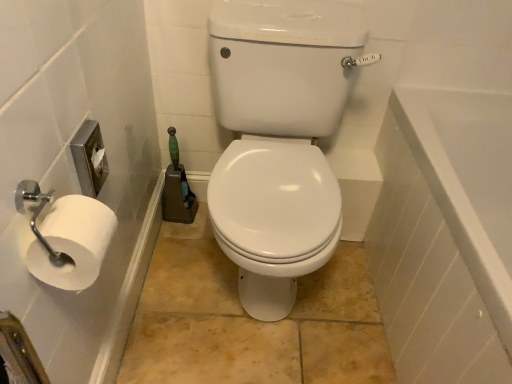
Looking at this image, what is the approximate height of white glossy bathtub at right?

The height of white glossy bathtub at right is 58.61 centimeters.

Measure the distance between point (470, 113) and camera.

Point (470, 113) and camera are 1.38 meters apart from each other.

The image size is (512, 384). Describe the element at coordinates (71, 242) in the screenshot. I see `white matte toilet paper at left` at that location.

You are a GUI agent. You are given a task and a screenshot of the screen. Output one action in this format:
    pyautogui.click(x=<x>, y=<y>)
    Task: Click on the white glossy toilet seat at center
    The image size is (512, 384).
    Given the screenshot: What is the action you would take?
    pyautogui.click(x=279, y=139)

Can you confirm if white matte toilet paper at left is taller than white glossy toilet seat at center?

In fact, white matte toilet paper at left may be shorter than white glossy toilet seat at center.

From the image's perspective, would you say white matte toilet paper at left is positioned over white glossy toilet seat at center?

No, from the image's perspective, white matte toilet paper at left is not over white glossy toilet seat at center.

From a real-world perspective, is white matte toilet paper at left physically above white glossy toilet seat at center?

Yes, from a real-world perspective, white matte toilet paper at left is on top of white glossy toilet seat at center.

Would you say white glossy bathtub at right is part of white glossy toilet seat at center's contents?

That's incorrect, white glossy bathtub at right is not inside white glossy toilet seat at center.

Which is behind, white glossy toilet seat at center or white glossy bathtub at right?

white glossy toilet seat at center is more distant.

Is white glossy toilet seat at center next to white glossy bathtub at right and touching it?

No, white glossy toilet seat at center is not with white glossy bathtub at right.

From a real-world perspective, which is physically below, white glossy toilet seat at center or white glossy bathtub at right?

In real-world perspective, white glossy bathtub at right is lower.

Does white matte toilet paper at left have a greater width compared to white glossy bathtub at right?

In fact, white matte toilet paper at left might be narrower than white glossy bathtub at right.

Is white matte toilet paper at left bigger or smaller than white glossy bathtub at right?

Considering their sizes, white matte toilet paper at left takes up less space than white glossy bathtub at right.

Looking at this image, choose the correct answer: Is white matte toilet paper at left inside white glossy bathtub at right or outside it?

white matte toilet paper at left is spatially situated outside white glossy bathtub at right.

Is point (84, 221) more distant than point (506, 153)?

No, it is in front of (506, 153).

You are a GUI agent. You are given a task and a screenshot of the screen. Output one action in this format:
    pyautogui.click(x=<x>, y=<y>)
    Task: Click on the bath below the white glossy toilet seat at center (from the image's perspective)
    
    Given the screenshot: What is the action you would take?
    pyautogui.click(x=445, y=236)

From the image's perspective, which is above, white glossy bathtub at right or white glossy toilet seat at center?

white glossy toilet seat at center, from the image's perspective.

Considering the sizes of objects white glossy bathtub at right and white glossy toilet seat at center in the image provided, who is smaller, white glossy bathtub at right or white glossy toilet seat at center?

white glossy toilet seat at center is smaller.

Consider the image. Between white glossy bathtub at right and white matte toilet paper at left, which one has larger width?

Wider between the two is white glossy bathtub at right.

Can you tell me how much white glossy bathtub at right and white matte toilet paper at left differ in facing direction?

180 degrees.

From the image's perspective, is white glossy bathtub at right above or below white matte toilet paper at left?

Clearly, from the image's perspective, white glossy bathtub at right is below white matte toilet paper at left.

Could white matte toilet paper at left be considered to be inside white glossy toilet seat at center?

That's incorrect, white matte toilet paper at left is not inside white glossy toilet seat at center.

From a real-world perspective, is white glossy toilet seat at center located higher than white matte toilet paper at left?

Actually, white glossy toilet seat at center is physically below white matte toilet paper at left in the real world.

Can you see white glossy toilet seat at center touching white matte toilet paper at left?

white glossy toilet seat at center and white matte toilet paper at left are not in contact.

At what (x,y) coordinates should I click in order to perform the action: click on toilet paper below the white glossy toilet seat at center (from the image's perspective). Please return your answer as a coordinate pair (x, y). This screenshot has height=384, width=512. Looking at the image, I should click on (71, 242).

Image resolution: width=512 pixels, height=384 pixels. Find the location of `bath directly beneath the white glossy toilet seat at center (from a real-world perspective)`. bath directly beneath the white glossy toilet seat at center (from a real-world perspective) is located at coordinates (445, 236).

Based on the photo, looking at the image, which one is located closer to white matte toilet paper at left, white glossy toilet seat at center or white glossy bathtub at right?

Based on the image, white glossy toilet seat at center appears to be nearer to white matte toilet paper at left.

Looking at the image, which one is located closer to white glossy bathtub at right, white glossy toilet seat at center or white matte toilet paper at left?

white glossy toilet seat at center lies closer to white glossy bathtub at right than the other object.

Which object lies nearer to the anchor point white matte toilet paper at left, white glossy bathtub at right or white glossy toilet seat at center?

Among the two, white glossy toilet seat at center is located nearer to white matte toilet paper at left.

From the image, which object appears to be farther from white glossy toilet seat at center, white matte toilet paper at left or white glossy bathtub at right?

Based on the image, white matte toilet paper at left appears to be further to white glossy toilet seat at center.

Considering their positions, is white matte toilet paper at left positioned closer to white glossy bathtub at right than white glossy toilet seat at center?

Based on the image, white glossy toilet seat at center appears to be nearer to white glossy bathtub at right.

Based on their spatial positions, is white glossy bathtub at right or white matte toilet paper at left further from white glossy toilet seat at center?

white matte toilet paper at left.

Find the location of `sit between white matte toilet paper at left and white glossy bathtub at right`. sit between white matte toilet paper at left and white glossy bathtub at right is located at coordinates (279, 139).